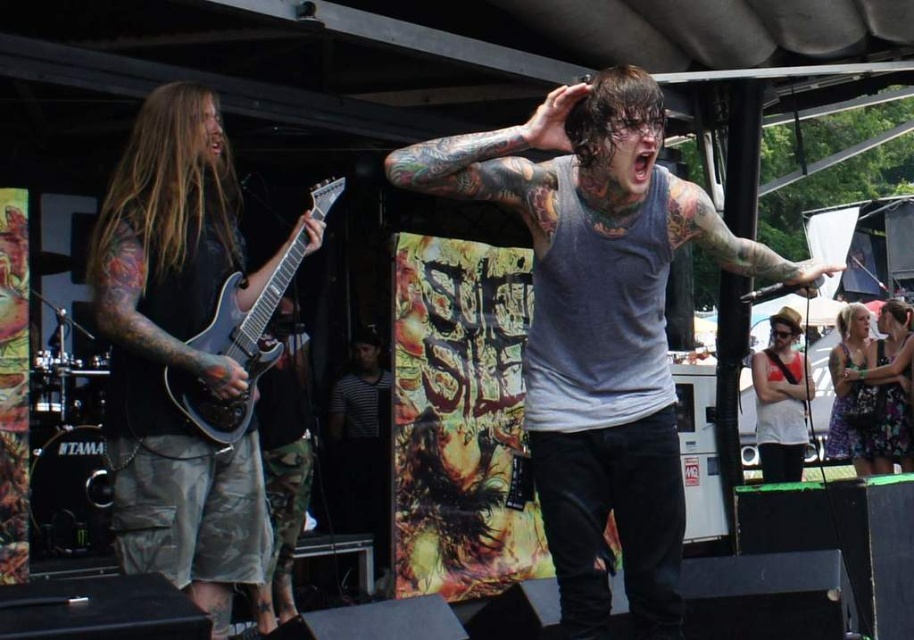
Question: Is gray tank top at center positioned behind metallic silver electric guitar at left?

Choices:
 (A) yes
 (B) no

Answer: (B)

Question: Among these objects, which one is nearest to the camera?

Choices:
 (A) white tank top at center
 (B) metallic silver electric guitar at left
 (C) floral dress at lower right
 (D) gray tank top at center

Answer: (D)

Question: Is gray tank top at center bigger than matte black guitar at left?

Choices:
 (A) yes
 (B) no

Answer: (A)

Question: Is gray tank top at center in front of white tank top at center?

Choices:
 (A) yes
 (B) no

Answer: (A)

Question: Which point appears farthest from the camera in this image?

Choices:
 (A) (597, 445)
 (B) (767, 348)

Answer: (B)

Question: Among these points, which one is nearest to the camera?

Choices:
 (A) (905, 435)
 (B) (629, 326)
 (C) (213, 429)

Answer: (B)